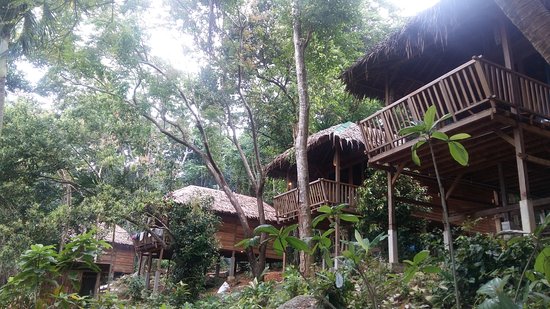
Locate an element on the screen. The width and height of the screenshot is (550, 309). support beams is located at coordinates (522, 164), (390, 211), (338, 238), (337, 170).